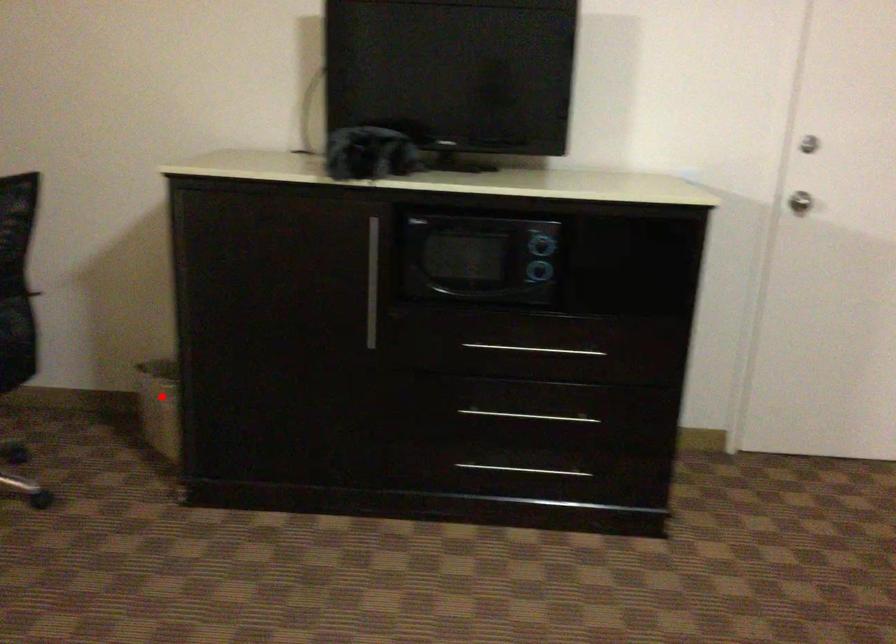
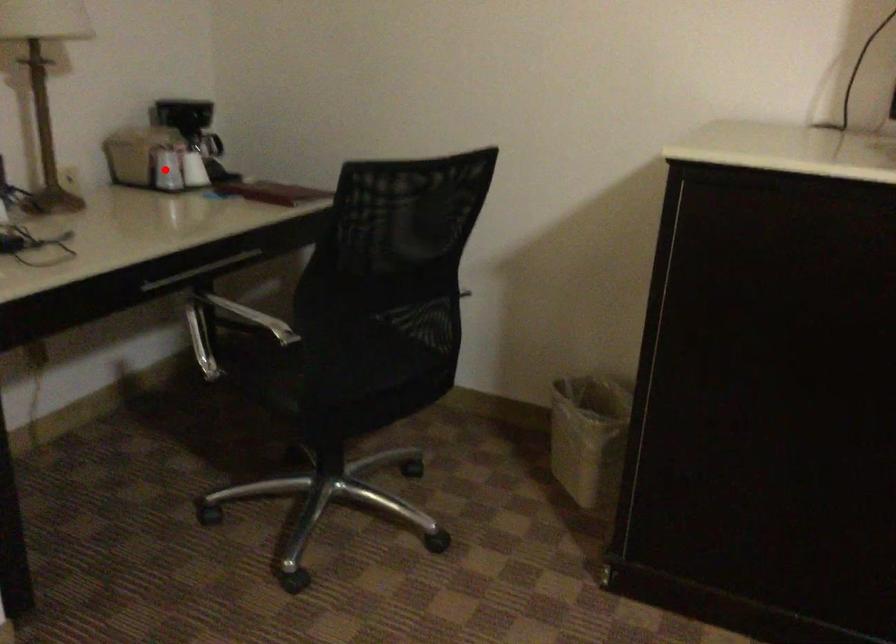
I am providing you with two images of the same scene from different viewpoints. A red point is marked on the first image and another point is marked on the second image. Is the marked point in image1 the same physical position as the marked point in image2?

No